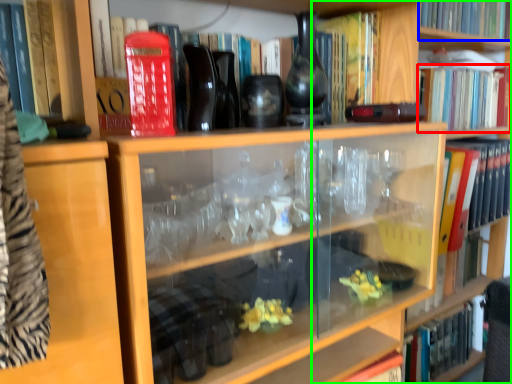
Question: Which object is positioned closest to book (highlighted by a red box)? Select from book (highlighted by a blue box) and bookshelf (highlighted by a green box).

Choices:
 (A) book
 (B) bookshelf

Answer: (A)